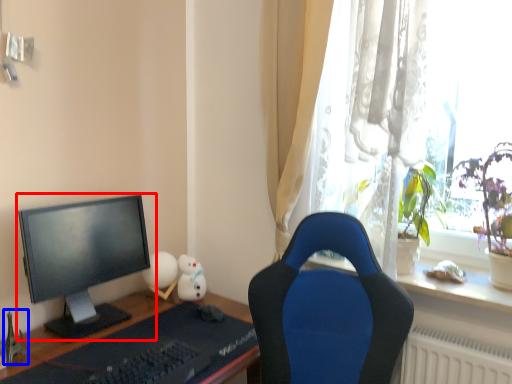
Question: Among these objects, which one is nearest to the camera, computer monitor (highlighted by a red box) or toy (highlighted by a blue box)?

Choices:
 (A) computer monitor
 (B) toy

Answer: (A)